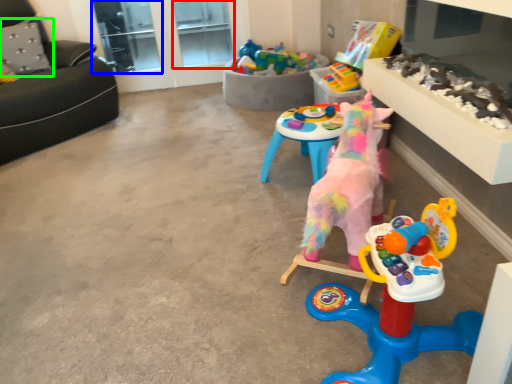
Question: Which is farther away from window screen (highlighted by a red box)? glass door (highlighted by a blue box) or pillow (highlighted by a green box)?

Choices:
 (A) glass door
 (B) pillow

Answer: (B)